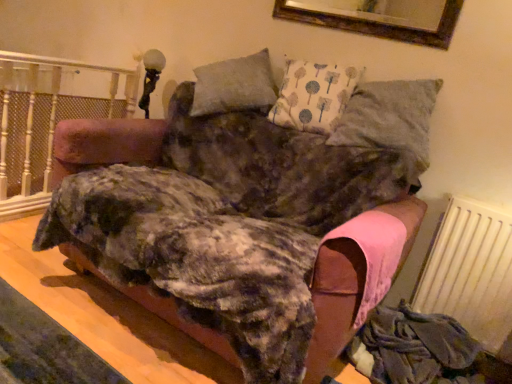
Measure the distance between point (463, 308) and camera.

A distance of 5.97 feet exists between point (463, 308) and camera.

What do you see at coordinates (391, 121) in the screenshot? This screenshot has height=384, width=512. I see `textured gray pillow at upper right` at bounding box center [391, 121].

In order to face textured gray pillow at upper right, should I rotate leftwards or rightwards?

You should look right and rotate roughly 17.661 degrees.

At what (x,y) coordinates should I click in order to perform the action: click on velvet pink sofa at center. Please return your answer as a coordinate pair (x, y). The height and width of the screenshot is (384, 512). Looking at the image, I should click on (241, 207).

Does white textured radiator at lower right have a smaller size compared to textured gray pillow at upper right?

Indeed, white textured radiator at lower right has a smaller size compared to textured gray pillow at upper right.

Considering the sizes of objects white textured radiator at lower right and textured gray pillow at upper right in the image provided, who is taller, white textured radiator at lower right or textured gray pillow at upper right?

white textured radiator at lower right is taller.

From the image's perspective, which object appears higher, white textured radiator at lower right or textured gray pillow at upper right?

textured gray pillow at upper right is shown above in the image.

Can you confirm if white textured radiator at lower right is positioned to the right of textured gray pillow at upper right?

Indeed, white textured radiator at lower right is positioned on the right side of textured gray pillow at upper right.

Is velvet pink sofa at center turned away from textured gray pillow at upper right?

No, textured gray pillow at upper right is not at the back of velvet pink sofa at center.

Considering the relative sizes of velvet pink sofa at center and textured gray pillow at upper right in the image provided, is velvet pink sofa at center thinner than textured gray pillow at upper right?

No.

Which point is more distant from viewer, (177,239) or (372,129)?

Positioned behind is point (372,129).

Which object is positioned more to the right, white painted wood at left or white textured radiator at lower right?

white textured radiator at lower right is more to the right.

Is white painted wood at left shorter than white textured radiator at lower right?

Correct, white painted wood at left is not as tall as white textured radiator at lower right.

Is white painted wood at left turned away from white textured radiator at lower right?

Yes.

Looking at the image, does white painted wood at left seem bigger or smaller compared to white textured radiator at lower right?

In the image, white painted wood at left appears to be larger than white textured radiator at lower right.

Who is more distant, velvet pink sofa at center or white textured radiator at lower right?

white textured radiator at lower right is more distant.

How many degrees apart are the facing directions of velvet pink sofa at center and white textured radiator at lower right?

They differ by 1.67 degrees in their facing directions.

Is velvet pink sofa at center shorter than white textured radiator at lower right?

Incorrect, the height of velvet pink sofa at center does not fall short of that of white textured radiator at lower right.

Considering the points (381, 185) and (447, 277), which point is in front, point (381, 185) or point (447, 277)?

The point (381, 185) is closer.

Is white painted wood at left bigger than textured gray pillow at upper right?

Actually, white painted wood at left might be smaller than textured gray pillow at upper right.

Is white painted wood at left inside the boundaries of textured gray pillow at upper right, or outside?

white painted wood at left is spatially situated outside textured gray pillow at upper right.

Is white painted wood at left in front of textured gray pillow at upper right?

No, white painted wood at left is behind textured gray pillow at upper right.

Considering the sizes of objects white painted wood at left and textured gray pillow at upper right in the image provided, who is taller, white painted wood at left or textured gray pillow at upper right?

With more height is white painted wood at left.

Which object is positioned more to the left, white textured radiator at lower right or white painted wood at left?

Positioned to the left is white painted wood at left.

In terms of width, does white textured radiator at lower right look wider or thinner when compared to white painted wood at left?

white textured radiator at lower right is wider than white painted wood at left.

Is white textured radiator at lower right closer to the viewer compared to white painted wood at left?

Yes, white textured radiator at lower right is closer to the camera.

Would you consider white painted wood at left to be distant from velvet pink sofa at center?

Yes.

Is white painted wood at left positioned beyond the bounds of velvet pink sofa at center?

white painted wood at left lies outside velvet pink sofa at center's area.

Is white painted wood at left wider than velvet pink sofa at center?

Incorrect, the width of white painted wood at left does not surpass that of velvet pink sofa at center.

In the scene shown: Is white painted wood at left to the right of velvet pink sofa at center from the viewer's perspective?

No.

Find the location of `pillow in front of the white textured radiator at lower right`. pillow in front of the white textured radiator at lower right is located at coordinates (391, 121).

The width and height of the screenshot is (512, 384). Find the location of `pillow positioned vertically above the velvet pink sofa at center (from a real-world perspective)`. pillow positioned vertically above the velvet pink sofa at center (from a real-world perspective) is located at coordinates pos(391,121).

From the image, which object appears to be nearer to velvet pink sofa at center, white textured radiator at lower right or white painted wood at left?

→ white textured radiator at lower right.

When comparing their distances from textured gray pillow at upper right, does white painted wood at left or white textured radiator at lower right seem further?

white painted wood at left lies further to textured gray pillow at upper right than the other object.

When comparing their distances from textured gray pillow at upper right, does white textured radiator at lower right or white painted wood at left seem closer?

white textured radiator at lower right lies closer to textured gray pillow at upper right than the other object.

Which object lies nearer to the anchor point textured gray pillow at upper right, velvet pink sofa at center or white textured radiator at lower right?

velvet pink sofa at center lies closer to textured gray pillow at upper right than the other object.

Looking at the image, which one is located further to white textured radiator at lower right, textured gray pillow at upper right or white painted wood at left?

Among the two, white painted wood at left is located further to white textured radiator at lower right.

Considering their positions, is white painted wood at left positioned closer to velvet pink sofa at center than textured gray pillow at upper right?

textured gray pillow at upper right is positioned closer to the anchor velvet pink sofa at center.

From the picture: Which object lies nearer to the anchor point textured gray pillow at upper right, white textured radiator at lower right or velvet pink sofa at center?

velvet pink sofa at center.

Estimate the real-world distances between objects in this image. Which object is closer to white painted wood at left, white textured radiator at lower right or velvet pink sofa at center?

velvet pink sofa at center is positioned closer to the anchor white painted wood at left.

What are the coordinates of `furniture between white painted wood at left and textured gray pillow at upper right` in the screenshot? It's located at (241, 207).

Locate an element on the screen. furniture situated between white painted wood at left and white textured radiator at lower right from left to right is located at coordinates coord(241,207).

Find the location of a particular element. pillow located between velvet pink sofa at center and white textured radiator at lower right in the left-right direction is located at coordinates (391, 121).

Locate an element on the screen. The width and height of the screenshot is (512, 384). pillow between white painted wood at left and white textured radiator at lower right in the horizontal direction is located at coordinates point(391,121).